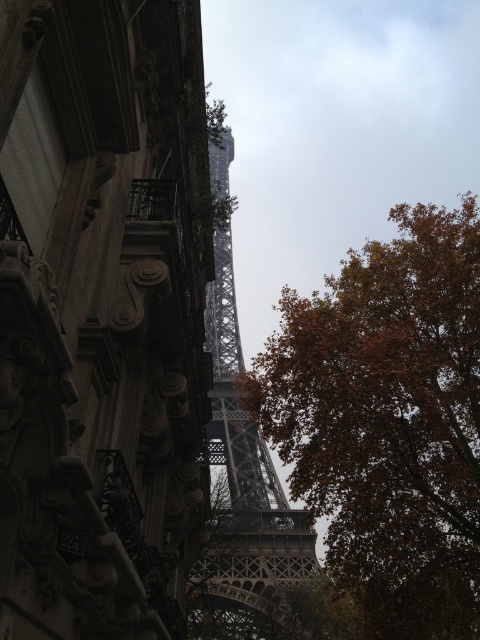
In the scene shown: Does brown leafy tree at center have a larger size compared to metallic gray eiffel tower at center?

No.

Can you confirm if brown leafy tree at center is positioned to the right of metallic gray eiffel tower at center?

Yes, brown leafy tree at center is to the right of metallic gray eiffel tower at center.

Does point (435, 264) come farther from viewer compared to point (304, 513)?

No, (435, 264) is closer to viewer.

I want to click on brown leafy tree at center, so click(387, 420).